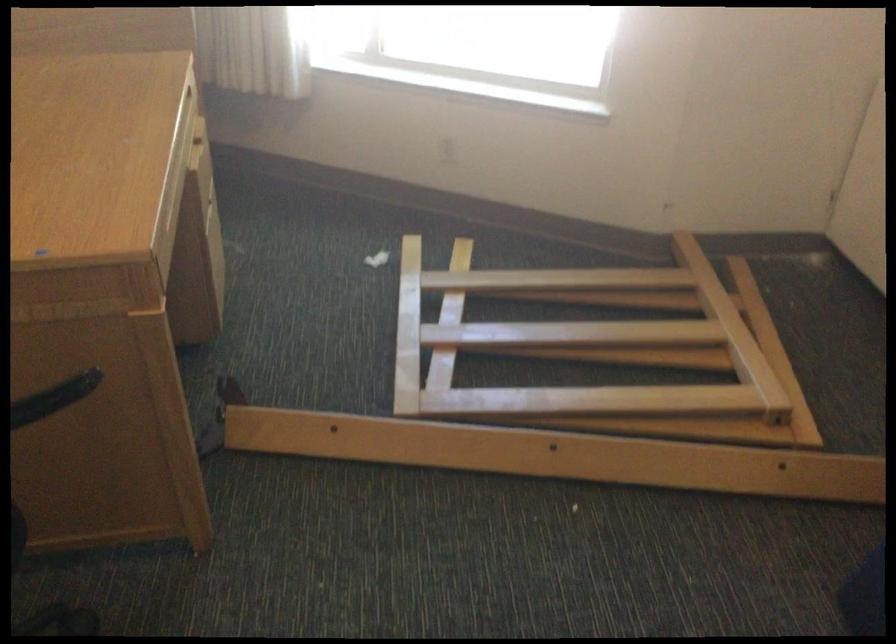
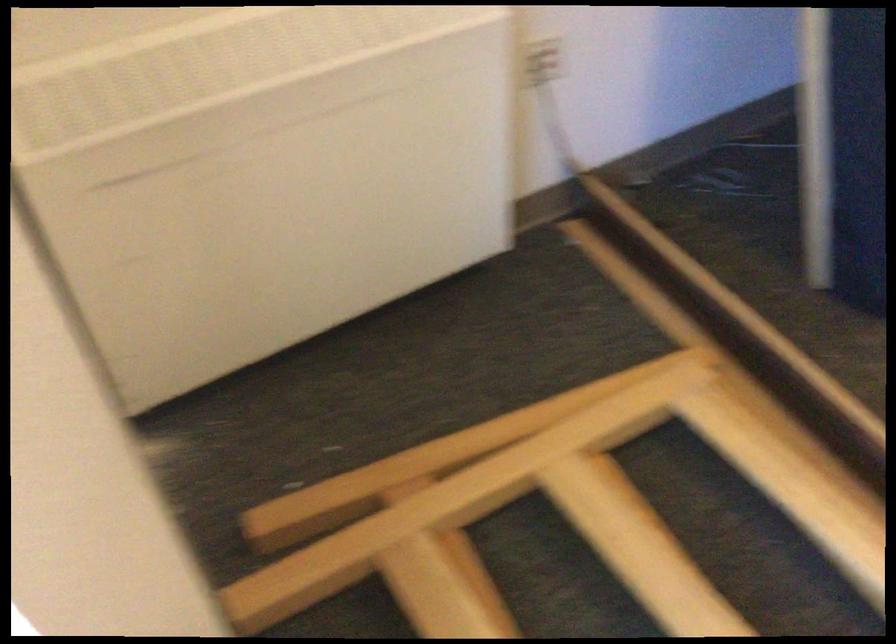
Locate, in the second image, the point that corresponds to point (735, 460) in the first image.

(777, 418)